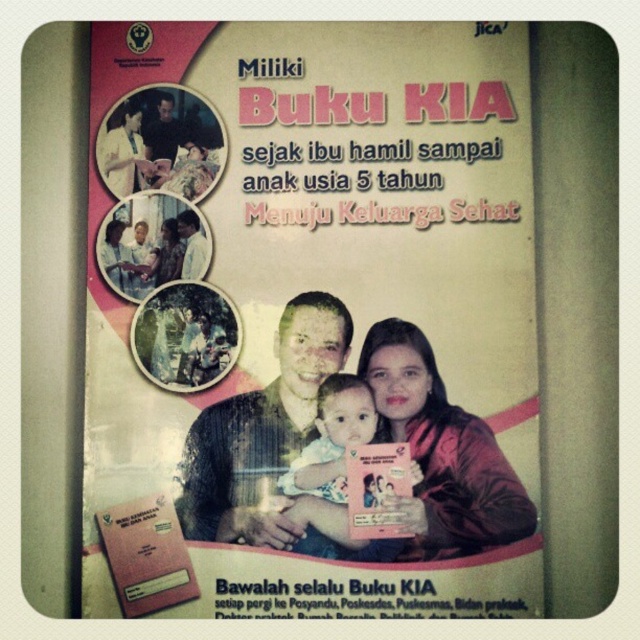
Question: Does pink satin jacket at center appear over matte black laptop at upper left?

Choices:
 (A) no
 (B) yes

Answer: (A)

Question: Which object is positioned closest to the matte white shirt at center?

Choices:
 (A) pink satin jacket at center
 (B) soft pink fabric baby at center

Answer: (B)

Question: Is matte black laptop at upper left in front of soft pink fabric baby at center?

Choices:
 (A) no
 (B) yes

Answer: (A)

Question: Can you confirm if pink satin jacket at center is smaller than soft pink fabric baby at center?

Choices:
 (A) no
 (B) yes

Answer: (A)

Question: Which of these objects is positioned farthest from the soft pink fabric baby at center?

Choices:
 (A) matte black laptop at upper left
 (B) matte white shirt at center
 (C) pink satin jacket at center

Answer: (A)

Question: Which object is farther from the camera taking this photo?

Choices:
 (A) matte black laptop at upper left
 (B) matte white shirt at center

Answer: (A)